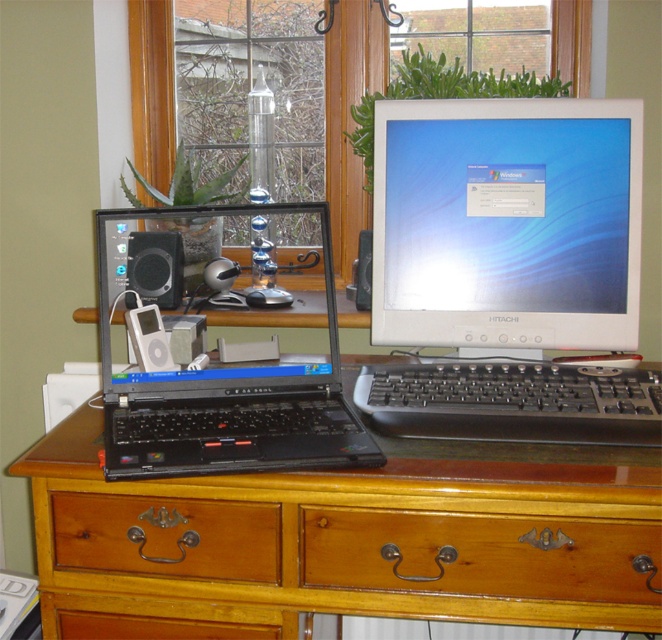
Who is more forward, (x=522, y=612) or (x=432, y=372)?

Positioned in front is point (x=522, y=612).

Does brown wood computer desk at center have a greater width compared to black plastic keyboard at center?

Yes.

Is point (175, 604) less distant than point (636, 408)?

That is True.

At what (x,y) coordinates should I click in order to perform the action: click on brown wood computer desk at center. Please return your answer as a coordinate pair (x, y). This screenshot has width=662, height=640. Looking at the image, I should click on (346, 540).

Between point (451, 157) and point (401, 429), which one is positioned in front?

Point (401, 429)

Is white glossy monitor at center above black plastic keyboard at center?

Yes, white glossy monitor at center is above black plastic keyboard at center.

Does point (516, 401) come behind point (585, 428)?

That is True.

Where is `white glossy monitor at center`? This screenshot has width=662, height=640. white glossy monitor at center is located at coordinates (506, 224).

Who is higher up, brown wood computer desk at center or black plastic laptop at left?

Positioned higher is black plastic laptop at left.

Who is taller, brown wood computer desk at center or black plastic laptop at left?

Standing taller between the two is black plastic laptop at left.

You are a GUI agent. You are given a task and a screenshot of the screen. Output one action in this format:
    pyautogui.click(x=<x>, y=<y>)
    Task: Click on the brown wood computer desk at center
    
    Given the screenshot: What is the action you would take?
    pyautogui.click(x=346, y=540)

You are a GUI agent. You are given a task and a screenshot of the screen. Output one action in this format:
    pyautogui.click(x=<x>, y=<y>)
    Task: Click on the brown wood computer desk at center
    This screenshot has width=662, height=640.
    Given the screenshot: What is the action you would take?
    pyautogui.click(x=346, y=540)